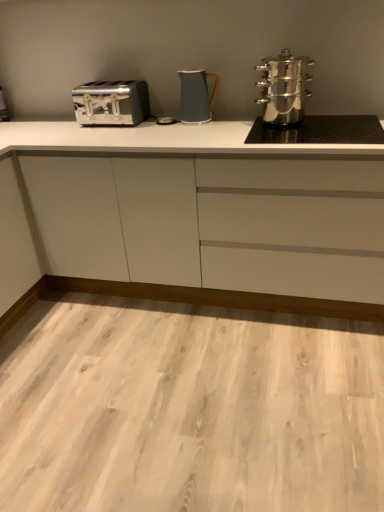
I want to click on vacant point to the left of satin chrome toaster at left, so click(x=57, y=131).